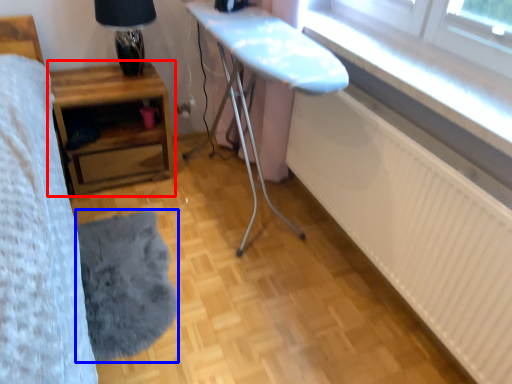
Question: Which point is further to the camera, table (highlighted by a red box) or mat (highlighted by a blue box)?

Choices:
 (A) table
 (B) mat

Answer: (A)